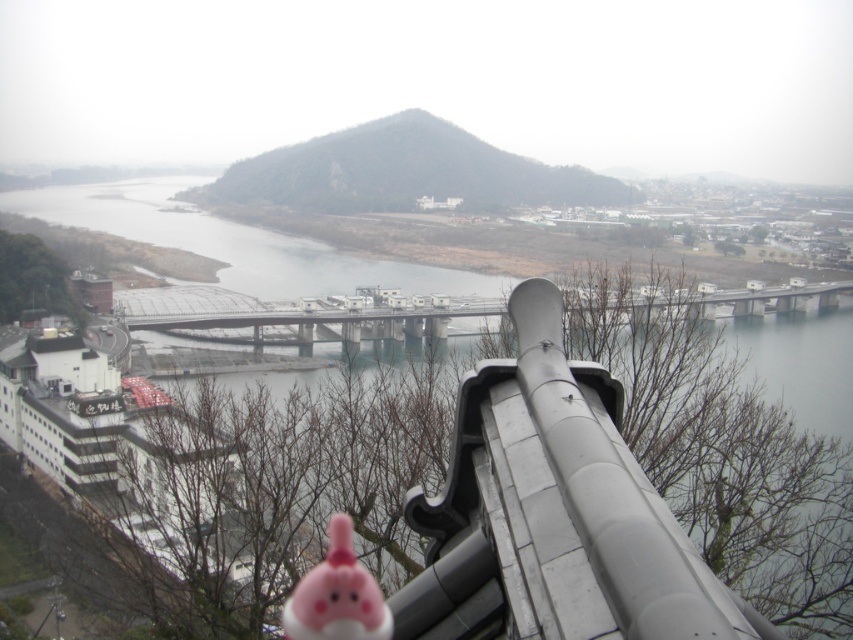
You are a boat captain planning to navigate a vessel through the river between the clear water at bridge center and the dark gray rocky peak at center. Can your boat pass through this area if it requires a minimum of 10 meters of width?

The clear water at bridge center has a larger width than the dark gray rocky peak at center. Since the boat requires a minimum of 10 meters, it depends on the exact width of the clear water. However, without specific measurements, we cannot confirm if it meets the requirement. Please verify the actual width before proceeding.

You are an architect designing a new pedestrian walkway that needs to cross the river shown in the image. The walkway must accommodate a minimum width of 2 meters. Given the clear water at bridge center and the matte pink plushie at lower center, can you determine if the existing bridge structure can support the required width for the walkway?

The clear water at bridge center has a larger size compared to the matte pink plushie at lower center. However, the exact dimensions of the bridge itself are not provided in the description, so it is impossible to confirm if the existing bridge structure can support the required 2 meter width for the walkway based solely on the available information.